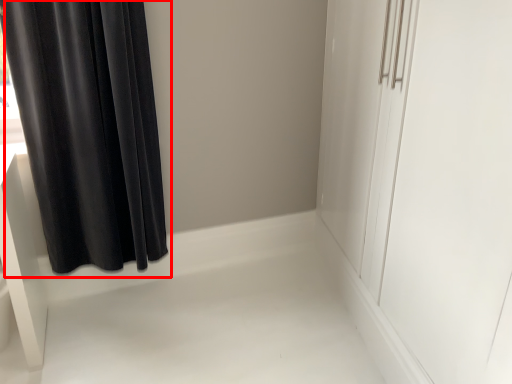
Question: From the image's perspective, what is the correct spatial positioning of curtain (annotated by the red box) in reference to screen door?

Choices:
 (A) below
 (B) above

Answer: (B)